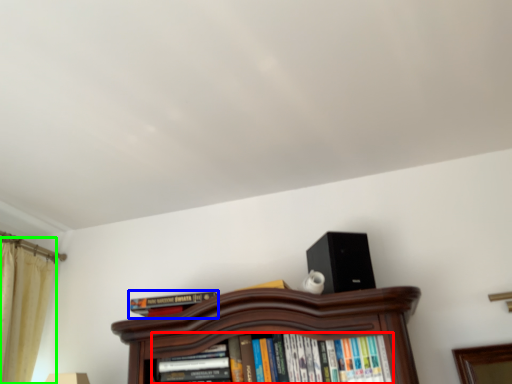
Question: Which object is the closest to the book (highlighted by a red box)? Choose among these: book (highlighted by a blue box) or curtain (highlighted by a green box).

Choices:
 (A) book
 (B) curtain

Answer: (A)